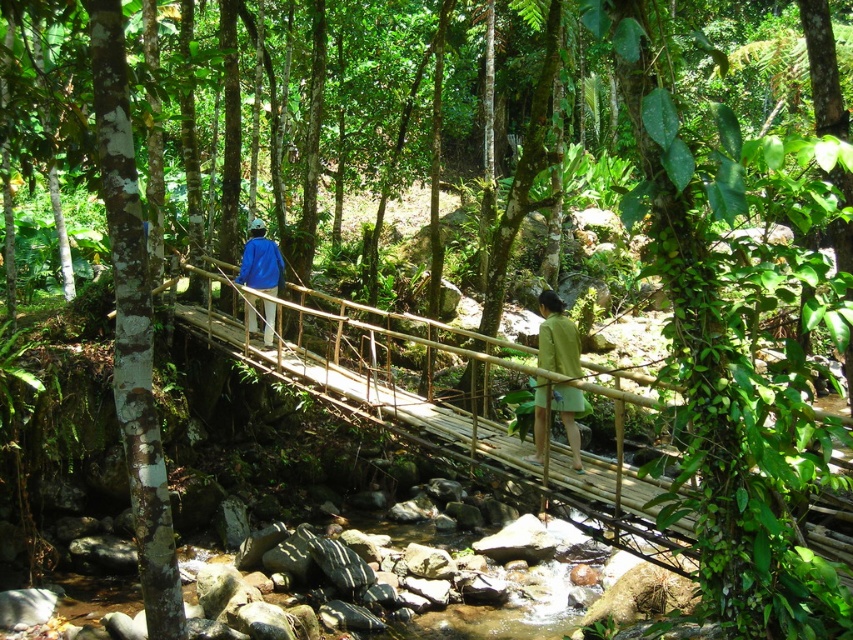
You are a hiker standing on the wooden suspension bridge and see a green matte skirt at center and a blue fabric jacket at center. Which item is positioned to the right side of the other?

The green matte skirt at center is to the right of the blue fabric jacket at center.

In the scene shown: You are a hiker who wants to cross the wooden suspension bridge. You notice two items on the bridge at the center. Which item takes up more area on the bridge? The green matte skirt at center or the blue fabric jacket at center?

The blue fabric jacket at center takes up more area on the bridge than the green matte skirt at center because the green matte skirt at center occupies less space than blue fabric jacket at center.

You are a hiker who has just arrived at the wooden suspension bridge. You notice a green matte skirt at center. Where is the green matte skirt located relative to the bridge?

The green matte skirt at center is located at point 0.528 on the x axis and 0.654 on the y axis, which is in the central area of the bridge.